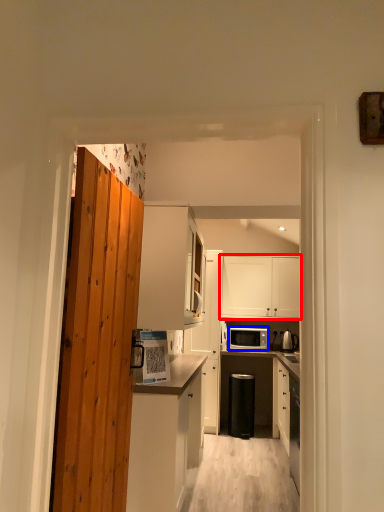
Question: Which object appears closest to the camera in this image, cabinetry (highlighted by a red box) or microwave oven (highlighted by a blue box)?

Choices:
 (A) cabinetry
 (B) microwave oven

Answer: (B)